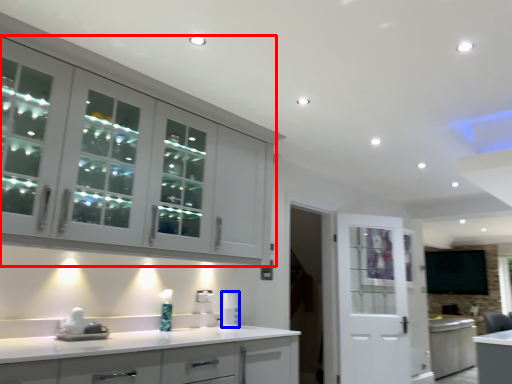
Question: Which point is closer to the camera, cabinetry (highlighted by a red box) or appliance (highlighted by a blue box)?

Choices:
 (A) cabinetry
 (B) appliance

Answer: (A)